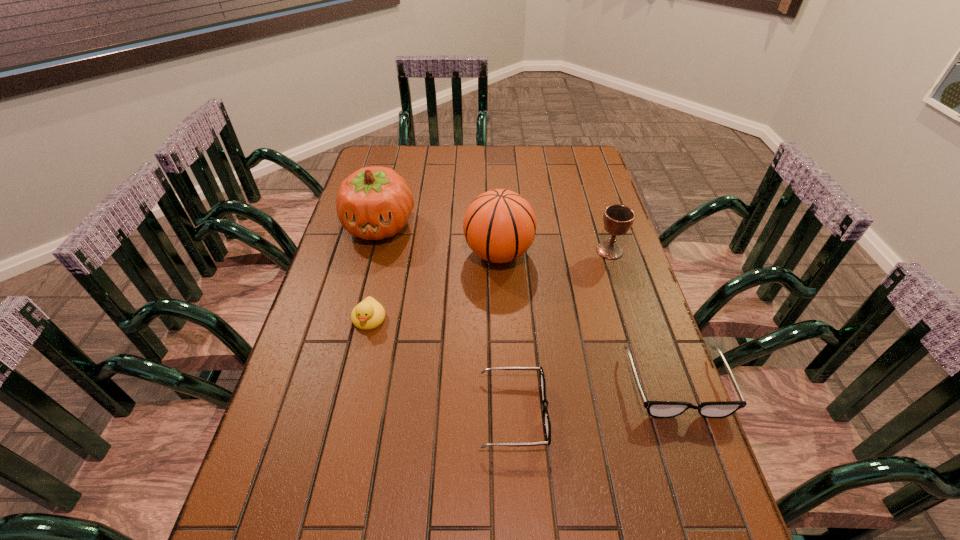
Find the location of a particular element. The image size is (960, 540). empty space between the right spectacles and the pumpkin is located at coordinates (528, 305).

Locate an element on the screen. empty space between the third tallest object and the fourth farthest object is located at coordinates (490, 285).

Find the location of a particular element. The width and height of the screenshot is (960, 540). object that is the fifth nearest to the shortest object is located at coordinates (373, 203).

At what (x,y) coordinates should I click in order to perform the action: click on the third closest object relative to the basketball. Please return your answer as a coordinate pair (x, y). The width and height of the screenshot is (960, 540). Looking at the image, I should click on (369, 314).

Locate an element on the screen. Image resolution: width=960 pixels, height=540 pixels. free space that satisfies the following two spatial constraints: 1. on the side of the pumpkin with the cute face; 2. on the left side of the basketball is located at coordinates 372,254.

Identify the location of free space that satisfies the following two spatial constraints: 1. on the side of the pumpkin with the cute face; 2. on the left side of the basketball. This screenshot has height=540, width=960. (372, 254).